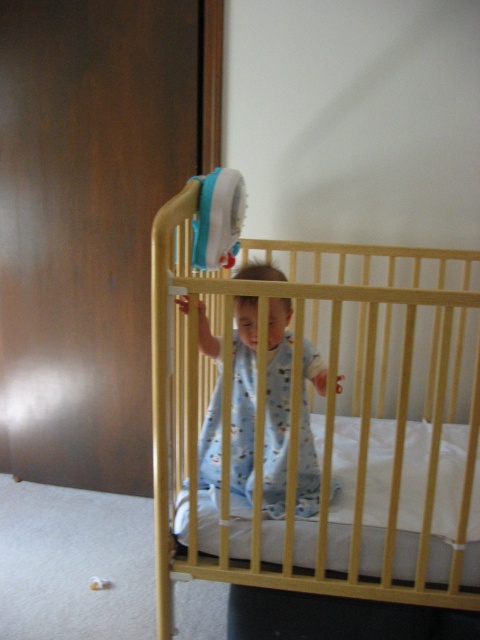
Who is positioned more to the right, light blue cotton onesie at center or blue fabric toy at upper center?

From the viewer's perspective, light blue cotton onesie at center appears more on the right side.

Is light blue cotton onesie at center closer to the viewer compared to blue fabric toy at upper center?

That is True.

Where is `light blue cotton onesie at center`? This screenshot has width=480, height=640. light blue cotton onesie at center is located at coordinates (276, 406).

This screenshot has width=480, height=640. What are the coordinates of `light blue cotton onesie at center` in the screenshot? It's located at click(276, 406).

Who is positioned more to the right, yellow wood crib at center or light blue cotton onesie at center?

From the viewer's perspective, yellow wood crib at center appears more on the right side.

Who is positioned more to the left, yellow wood crib at center or light blue cotton onesie at center?

From the viewer's perspective, light blue cotton onesie at center appears more on the left side.

This screenshot has width=480, height=640. Find the location of `yellow wood crib at center`. yellow wood crib at center is located at coordinates click(x=324, y=422).

Which is behind, point (376, 358) or point (230, 220)?

Point (376, 358)

Who is shorter, yellow wood crib at center or blue fabric toy at upper center?

Standing shorter between the two is blue fabric toy at upper center.

Image resolution: width=480 pixels, height=640 pixels. I want to click on yellow wood crib at center, so pyautogui.click(x=324, y=422).